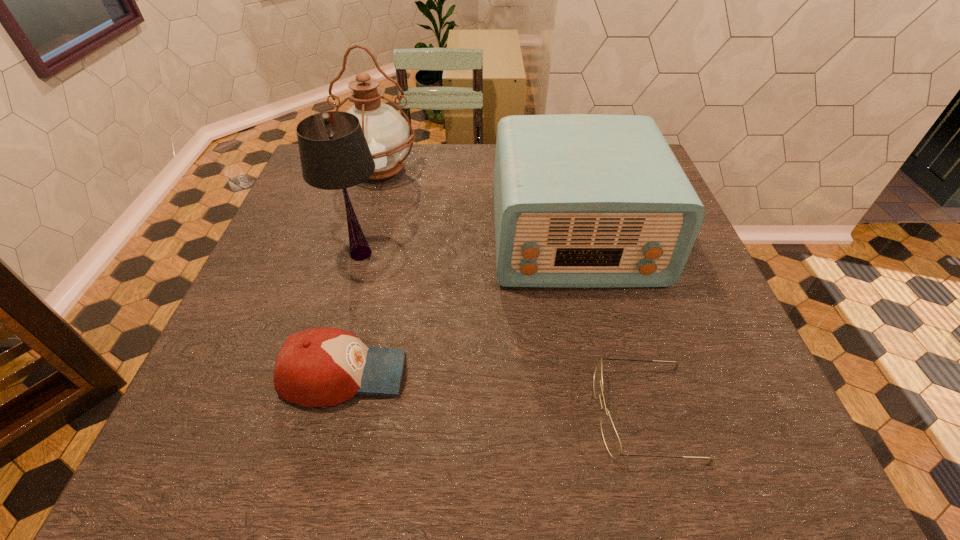
Find the location of a particular element. Image resolution: width=960 pixels, height=540 pixels. vacant area that lies between the lampshade and the farthest object is located at coordinates (371, 211).

The image size is (960, 540). In order to click on empty space that is in between the baseball cap and the third tallest object in this screenshot , I will do `click(459, 306)`.

This screenshot has height=540, width=960. I want to click on free spot between the spectacles and the lampshade, so click(502, 333).

This screenshot has width=960, height=540. I want to click on empty space that is in between the baseball cap and the radio receiver, so click(x=459, y=306).

Locate which object ranks fourth in proximity to the second shortest object. Please provide its 2D coordinates. Your answer should be formatted as a tuple, i.e. [(x, y)], where the tuple contains the x and y coordinates of a point satisfying the conditions above.

[(387, 133)]

Point out which object is positioned as the fourth nearest to the lampshade. Please provide its 2D coordinates. Your answer should be formatted as a tuple, i.e. [(x, y)], where the tuple contains the x and y coordinates of a point satisfying the conditions above.

[(611, 439)]

At what (x,y) coordinates should I click in order to perform the action: click on free space that satisfies the following two spatial constraints: 1. on the front panel of the third tallest object; 2. on the front-facing side of the fourth tallest object. Please return your answer as a coordinate pair (x, y). Looking at the image, I should click on (606, 374).